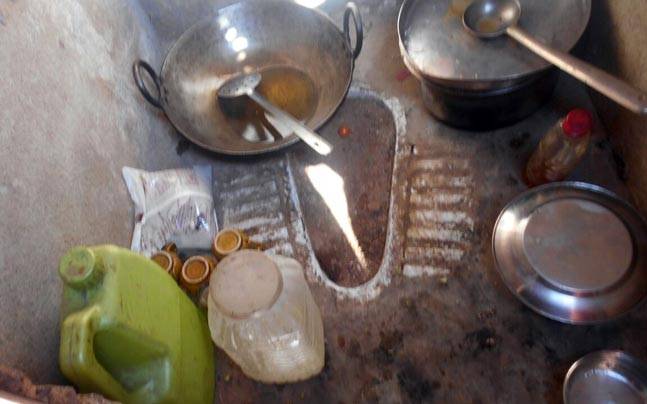
Locate an element on the screen. ceramic cups is located at coordinates tap(234, 238), tap(195, 270), tap(160, 256).